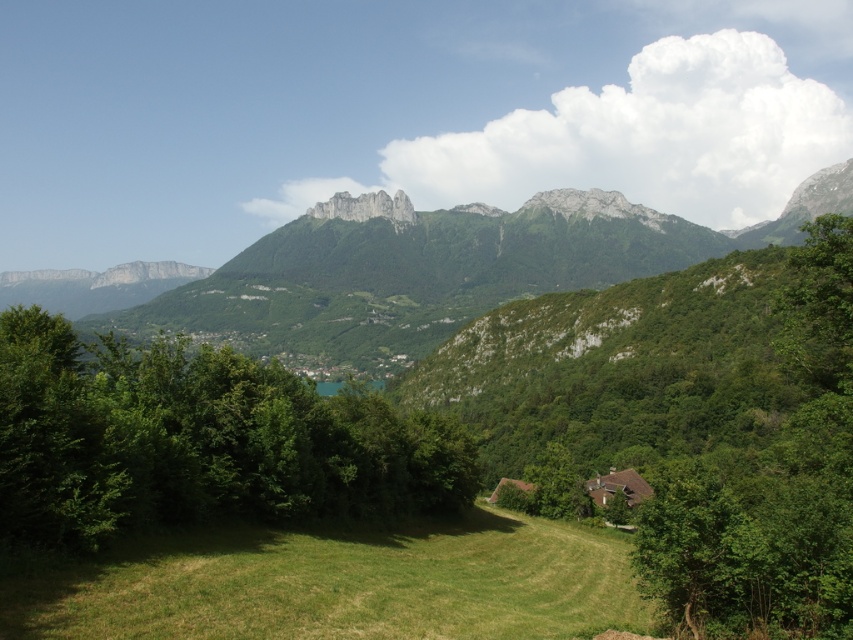
You are standing at the edge of the green grassy field at lower center. Looking towards the green leafy tree at center, which direction should you walk to reach it?

The green leafy tree at center is above the green grassy field at lower center, so you should walk forward or upwards to reach it.

You are standing at the point with coordinates (x=198, y=440) in the image. What object is located exactly at this point?

The green leafy tree at center is located exactly at point (x=198, y=440).

You are standing in the grassy field and want to reach the point at coordinates point (250, 442). However, there is an obstacle at point (415, 620). Can you walk directly to your destination without going around the obstacle?

Point (250, 442) is behind point (415, 620), so you cannot walk directly to point (250, 442) without going around the obstacle at point (415, 620).